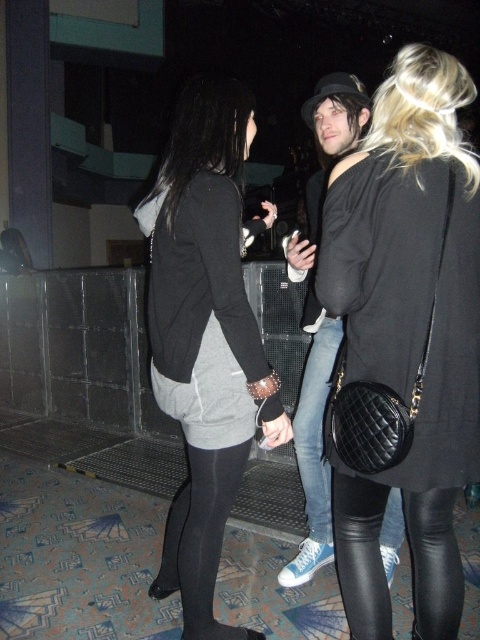
Question: Which point is closer to the camera taking this photo?

Choices:
 (A) (373, 508)
 (B) (448, 234)

Answer: (B)

Question: Is black leather pants at center to the left of black leather leggings at lower right from the viewer's perspective?

Choices:
 (A) no
 (B) yes

Answer: (B)

Question: Is dark gray fleece sweatshirt at center bigger than black leather leggings at lower right?

Choices:
 (A) no
 (B) yes

Answer: (B)

Question: Which of the following is the farthest from the observer?

Choices:
 (A) matte black jacket at center
 (B) black leather leggings at lower right
 (C) dark gray fleece sweatshirt at center
 (D) black leather pants at center

Answer: (A)

Question: Can you confirm if black leather pants at center is bigger than black leather leggings at lower right?

Choices:
 (A) no
 (B) yes

Answer: (B)

Question: Which of these objects is positioned farthest from the black leather pants at center?

Choices:
 (A) dark gray fleece sweatshirt at center
 (B) black leather leggings at lower right

Answer: (A)